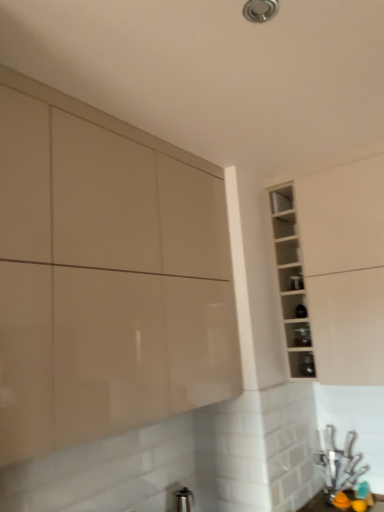
Question: Is matte black shelf at center-right, the 2th shelf in the bottom-to-top sequence, a part of glossy beige cabinet at upper left, arranged as the 1th cabinetry when viewed from the left?

Choices:
 (A) no
 (B) yes

Answer: (A)

Question: From a real-world perspective, does glossy beige cabinet at upper left, arranged as the 1th cabinetry when viewed from the left, stand above matte black shelf at center-right, the 2th shelf in the bottom-to-top sequence?

Choices:
 (A) no
 (B) yes

Answer: (B)

Question: Considering the relative sizes of glossy beige cabinet at upper left, arranged as the 1th cabinetry when viewed from the left, and matte black shelf at center-right, the 2th shelf in the bottom-to-top sequence, in the image provided, is glossy beige cabinet at upper left, arranged as the 1th cabinetry when viewed from the left, thinner than matte black shelf at center-right, the 2th shelf in the bottom-to-top sequence,?

Choices:
 (A) no
 (B) yes

Answer: (A)

Question: Is glossy beige cabinet at upper left, placed as the 2th cabinetry when sorted from right to left, located outside matte black shelf at center-right, placed as the second shelf when sorted from top to bottom?

Choices:
 (A) yes
 (B) no

Answer: (A)

Question: Is glossy beige cabinet at upper left, placed as the 2th cabinetry when sorted from right to left, bigger than matte black shelf at center-right, the 2th shelf in the bottom-to-top sequence?

Choices:
 (A) no
 (B) yes

Answer: (B)

Question: Is glossy beige cabinet at upper left, placed as the 2th cabinetry when sorted from right to left, at the left side of matte black shelf at center-right, placed as the second shelf when sorted from top to bottom?

Choices:
 (A) no
 (B) yes

Answer: (B)

Question: Could you tell me if matte black shelf at center-right, placed as the second shelf when sorted from top to bottom, is turned towards transparent glass shelf at upper right, which appears as the first shelf when viewed from the top?

Choices:
 (A) yes
 (B) no

Answer: (B)

Question: Is matte black shelf at center-right, the 2th shelf in the bottom-to-top sequence, positioned in front of transparent glass shelf at upper right, which appears as the first shelf when viewed from the top?

Choices:
 (A) yes
 (B) no

Answer: (A)

Question: Is matte black shelf at center-right, placed as the second shelf when sorted from top to bottom, shorter than transparent glass shelf at upper right, which appears as the 3th shelf when ordered from the bottom?

Choices:
 (A) no
 (B) yes

Answer: (B)

Question: Is transparent glass shelf at upper right, which appears as the first shelf when viewed from the top, located within matte black shelf at center-right, the 2th shelf in the bottom-to-top sequence?

Choices:
 (A) yes
 (B) no

Answer: (B)

Question: Is matte black shelf at center-right, placed as the second shelf when sorted from top to bottom, far from transparent glass shelf at upper right, which appears as the first shelf when viewed from the top?

Choices:
 (A) yes
 (B) no

Answer: (B)

Question: Is matte black shelf at center-right, the 2th shelf in the bottom-to-top sequence, positioned behind transparent glass shelf at upper right, which appears as the first shelf when viewed from the top?

Choices:
 (A) yes
 (B) no

Answer: (B)

Question: Does glossy beige cabinet at upper left, placed as the 2th cabinetry when sorted from right to left, have a lesser width compared to white glossy cabinet at upper right, which appears as the 2th cabinetry when viewed from the left?

Choices:
 (A) no
 (B) yes

Answer: (B)